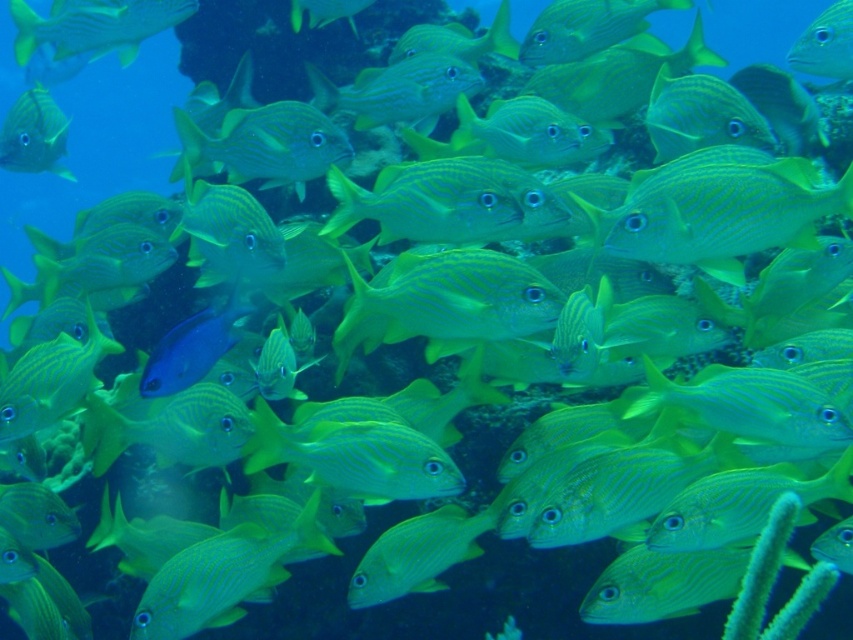
Is green matte fish at center above green striped fish at upper right?

Incorrect, green matte fish at center is not positioned above green striped fish at upper right.

Does green matte fish at center have a lesser height compared to green striped fish at upper right?

In fact, green matte fish at center may be taller than green striped fish at upper right.

Who is more distant from viewer, (451, 544) or (831, 68)?

Positioned behind is point (831, 68).

Identify the location of green matte fish at center. (416, 554).

Is green striped fish at center to the left of green matte fish at center from the viewer's perspective?

In fact, green striped fish at center is to the right of green matte fish at center.

Which is in front, point (653, 253) or point (372, 556)?

Point (653, 253)

Is point (734, 257) closer to camera compared to point (395, 593)?

Yes, it is in front of point (395, 593).

Find the location of a particular element. The image size is (853, 640). green striped fish at center is located at coordinates (718, 209).

Which is above, green matte fish at center or matte yellow fish at upper left?

matte yellow fish at upper left is above.

Is green matte fish at center to the right of matte yellow fish at upper left from the viewer's perspective?

Indeed, green matte fish at center is positioned on the right side of matte yellow fish at upper left.

Does point (413, 532) lie in front of point (45, 90)?

Yes, point (413, 532) is in front of point (45, 90).

Where is `green matte fish at center`? The width and height of the screenshot is (853, 640). green matte fish at center is located at coordinates (416, 554).